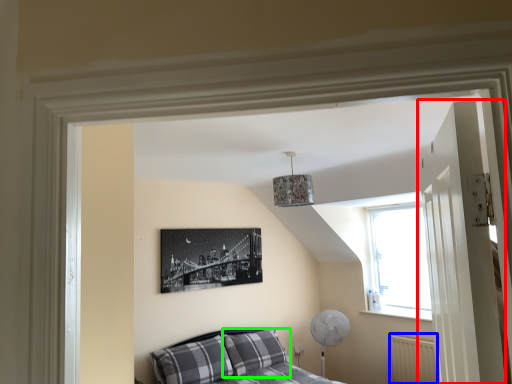
Question: Estimate the real-world distances between objects in this image. Which object is farther from door (highlighted by a red box), radiator (highlighted by a blue box) or pillow (highlighted by a green box)?

Choices:
 (A) radiator
 (B) pillow

Answer: (B)